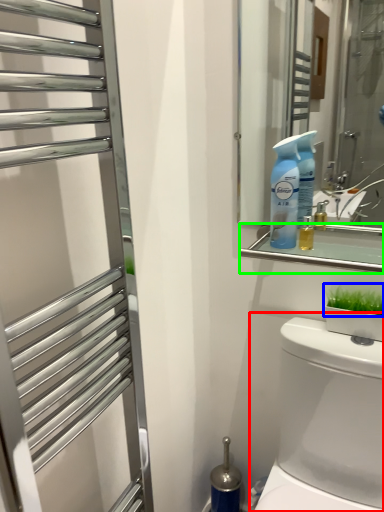
Question: Considering the real-world distances, which object is farthest from toilet (highlighted by a red box)? plant (highlighted by a blue box) or balustrade (highlighted by a green box)?

Choices:
 (A) plant
 (B) balustrade

Answer: (B)